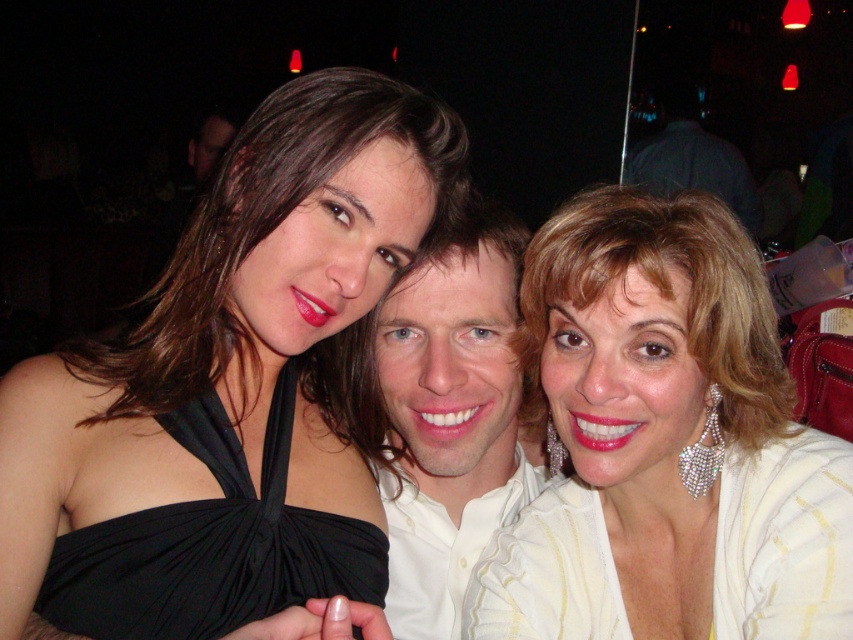
You are a photographer trying to focus on the black satin dress at center and the shiny silver earrings at upper right. Which object should you adjust your camera focus to first to ensure both are in focus?

The black satin dress at center is closer to the viewer than the shiny silver earrings at upper right, so you should focus on the black satin dress at center first to ensure both are in focus.